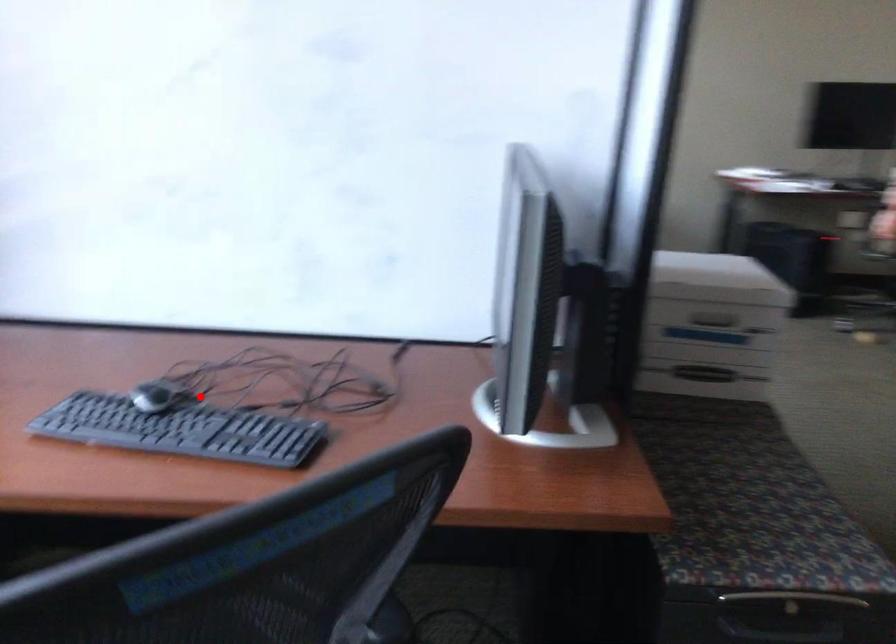
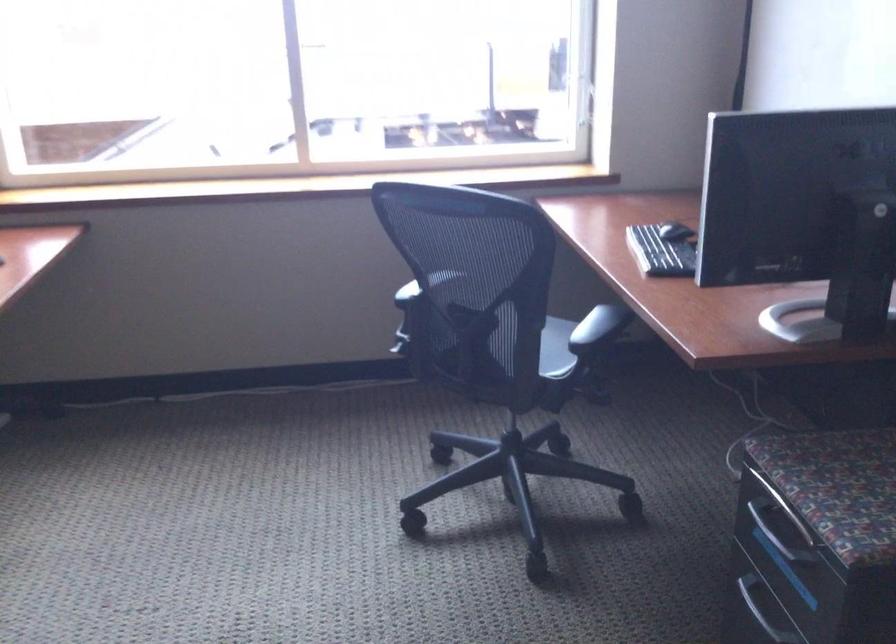
Question: I am providing you with two images of the same scene from different viewpoints. Image1 has a red point marked. In image2, the corresponding 3D location appears at what relative position? Reply with the corresponding letter.

Choices:
 (A) Closer
 (B) Farther

Answer: (B)